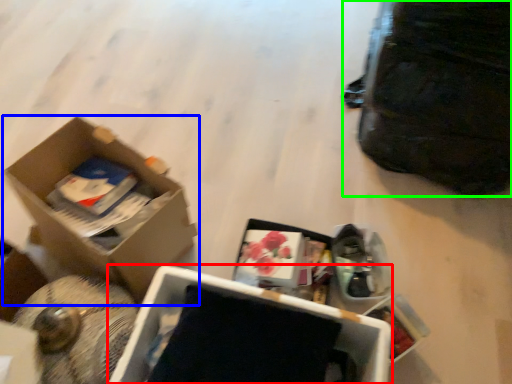
Question: Which object is the closest to the box (highlighted by a red box)? Choose among these: box (highlighted by a blue box) or bag (highlighted by a green box).

Choices:
 (A) box
 (B) bag

Answer: (A)